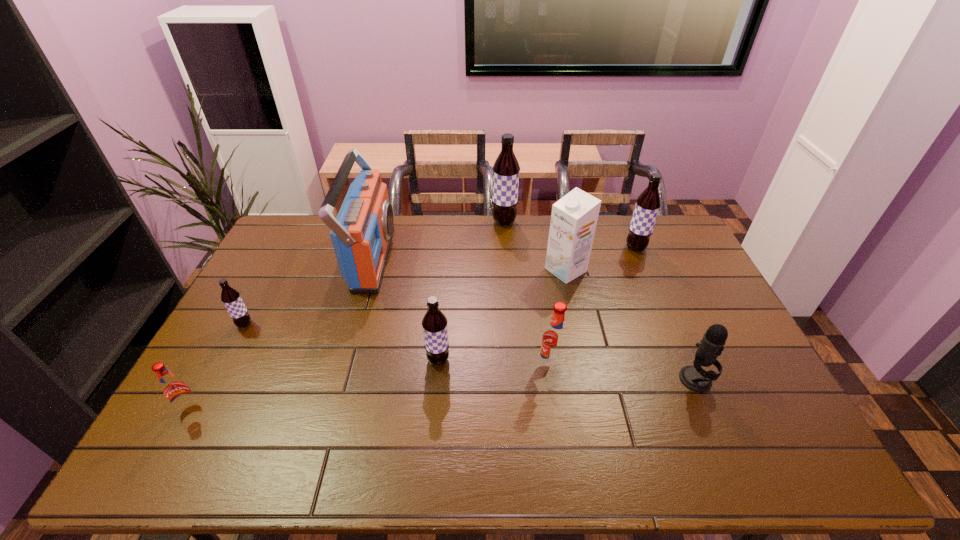
The width and height of the screenshot is (960, 540). I want to click on the right red root beer, so click(554, 341).

Identify the location of black microphone. (695, 378).

At what (x,y) coordinates should I click in order to perform the action: click on the left red root beer. Please return your answer as a coordinate pair (x, y). This screenshot has height=540, width=960. Looking at the image, I should click on (176, 391).

At what (x,y) coordinates should I click in order to perform the action: click on the smaller red root beer. Please return your answer as a coordinate pair (x, y). Looking at the image, I should click on (176, 391).

Where is `the leftmost brown root beer`? The image size is (960, 540). the leftmost brown root beer is located at coordinates (231, 298).

In order to click on the third farthest root beer in this screenshot , I will do `click(231, 298)`.

The height and width of the screenshot is (540, 960). What are the coordinates of `vacant space situated on the left of the fifth object from right to left` in the screenshot? It's located at (468, 222).

Image resolution: width=960 pixels, height=540 pixels. What are the coordinates of `vacant position located on the front-facing side of the radio receiver` in the screenshot? It's located at (419, 259).

Where is `blank space located 0.050m on the right of the second tallest root beer`? This screenshot has width=960, height=540. blank space located 0.050m on the right of the second tallest root beer is located at coordinates (660, 248).

In order to click on free space located on the left of the carton in this screenshot , I will do `click(465, 270)`.